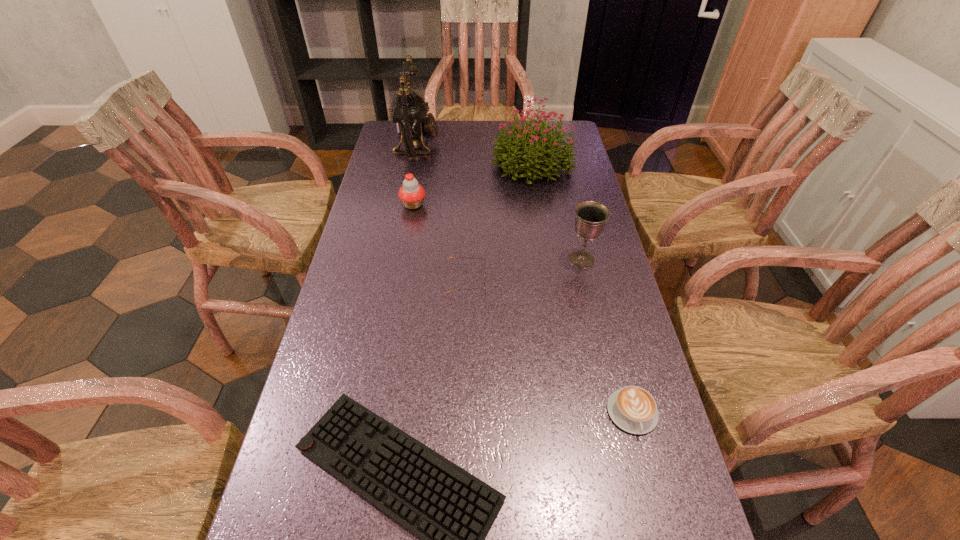
Identify the location of free space between the cappuccino and the tallest object. This screenshot has height=540, width=960. (525, 279).

Locate an element on the screen. The width and height of the screenshot is (960, 540). vacant space that is in between the tallest object and the fifth tallest object is located at coordinates (442, 212).

Identify the location of object that is the closest one to the computer keyboard. Image resolution: width=960 pixels, height=540 pixels. (632, 408).

This screenshot has width=960, height=540. In order to click on object that is the third closest to the telephone in this screenshot , I will do `click(450, 257)`.

Locate an element on the screen. blank space that satisfies the following two spatial constraints: 1. on the rotary dial of the tallest object; 2. on the left side of the chalice is located at coordinates (396, 260).

Where is `free location that satisfies the following two spatial constraints: 1. on the rotary dial of the telephone; 2. on the left side of the third tallest object`? free location that satisfies the following two spatial constraints: 1. on the rotary dial of the telephone; 2. on the left side of the third tallest object is located at coordinates (396, 260).